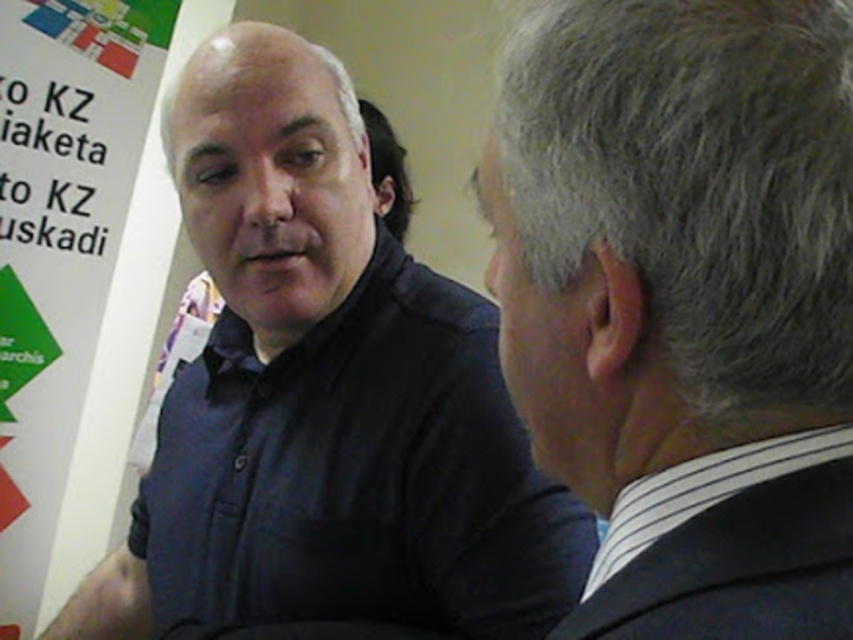
You are trying to read the text on the white paper at left but the matte black shirt at center is blocking your view. Can you move around to see it better?

The matte black shirt at center is in front of the white paper at left, so moving around to the side or behind the shirt might allow you to see the white paper at left better.

You are a photographer setting up for a group photo. You have two items in the scene to adjust their positions for better composition. The white paper at left and the white striped shirt at right. According to the scene description, which item is positioned more to the left side?

The white paper at left is positioned more to the left side than the white striped shirt at right.

You are a photographer who wants to focus on the matte black shirt at center in the image. Where should you point your camera to capture it?

You should point your camera to the coordinates point [325,394] to capture the matte black shirt at center.